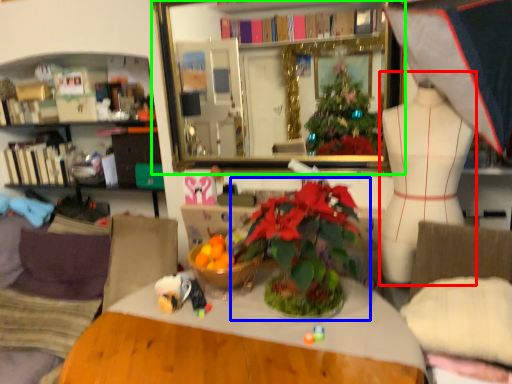
Question: Which is farther away from mannequin (highlighted by a red box)? houseplant (highlighted by a blue box) or mirror (highlighted by a green box)?

Choices:
 (A) houseplant
 (B) mirror

Answer: (B)